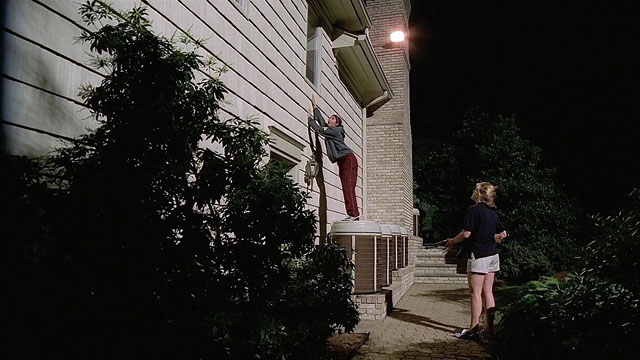
Locate an element on the screen. This screenshot has width=640, height=360. window is located at coordinates (314, 53), (281, 172).